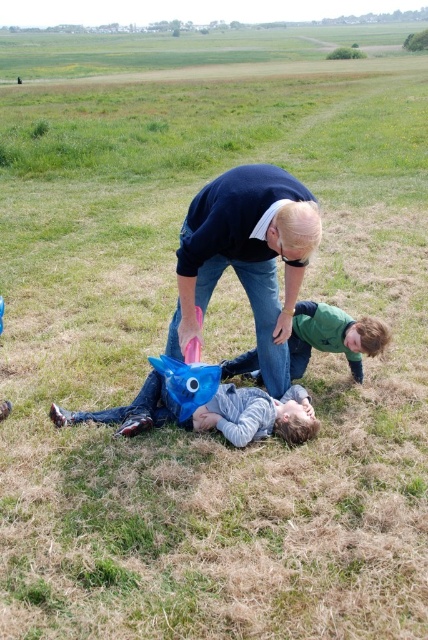
Is blue fabric bag at center behind blue matte mask at center?

No, blue fabric bag at center is in front of blue matte mask at center.

Is point (235, 262) positioned after point (112, 420)?

No, it is in front of (112, 420).

At what (x,y) coordinates should I click in order to perform the action: click on blue fabric bag at center. Please return your answer as a coordinate pair (x, y). This screenshot has height=640, width=428. Looking at the image, I should click on tap(246, 257).

Is blue fabric bag at center taller than green matte shirt at center?

Indeed, blue fabric bag at center has a greater height compared to green matte shirt at center.

Does point (285, 291) come in front of point (357, 342)?

Yes, point (285, 291) is closer to viewer.

What are the coordinates of `blue fabric bag at center` in the screenshot? It's located at (246, 257).

Looking at this image, which is above, blue matte mask at center or green matte shirt at center?

green matte shirt at center is higher up.

The height and width of the screenshot is (640, 428). What do you see at coordinates (208, 413) in the screenshot?
I see `blue matte mask at center` at bounding box center [208, 413].

Describe the element at coordinates (208, 413) in the screenshot. Image resolution: width=428 pixels, height=640 pixels. I see `blue matte mask at center` at that location.

The height and width of the screenshot is (640, 428). In order to click on blue matte mask at center in this screenshot , I will do `click(208, 413)`.